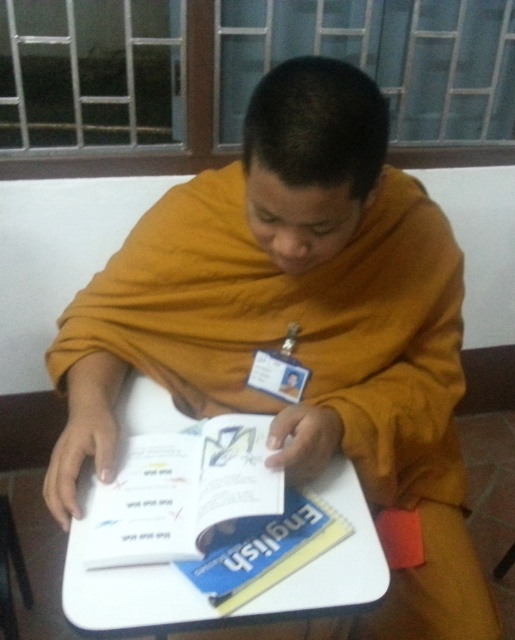
Can you confirm if white paper book at center is positioned to the right of blue hardcover book at center?

No, white paper book at center is not to the right of blue hardcover book at center.

Which is more to the left, white paper book at center or blue hardcover book at center?

Positioned to the left is white paper book at center.

Who is more forward, (185,445) or (266,586)?

Positioned in front is point (266,586).

At what (x,y) coordinates should I click in order to perform the action: click on white paper book at center. Please return your answer as a coordinate pair (x, y). Looking at the image, I should click on (182, 492).

Is white plastic table at center below blue hardcover book at center?

Actually, white plastic table at center is above blue hardcover book at center.

Who is more distant from viewer, (367, 550) or (226, 612)?

The point (367, 550) is more distant.

Locate an element on the screen. The height and width of the screenshot is (640, 515). white plastic table at center is located at coordinates (123, 586).

Between point (239, 420) and point (289, 531), which one is positioned in front?

Point (289, 531) is more forward.

How much distance is there between white paper book at center and blue paper english book at center?

The distance of white paper book at center from blue paper english book at center is 3.64 inches.

Is point (110, 529) positioned behind point (253, 536)?

That is False.

At what (x,y) coordinates should I click in order to perform the action: click on white paper book at center. Please return your answer as a coordinate pair (x, y). The image size is (515, 640). Looking at the image, I should click on (182, 492).